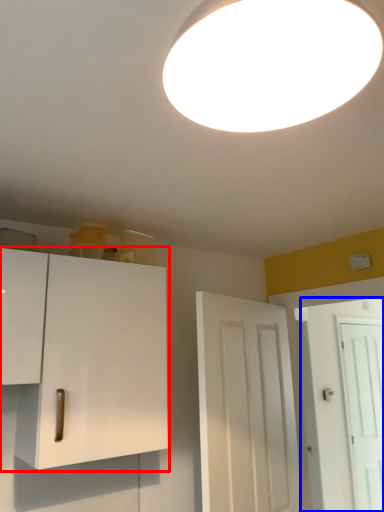
Question: Among these objects, which one is nearest to the camera, cabinetry (highlighted by a red box) or door (highlighted by a blue box)?

Choices:
 (A) cabinetry
 (B) door

Answer: (A)